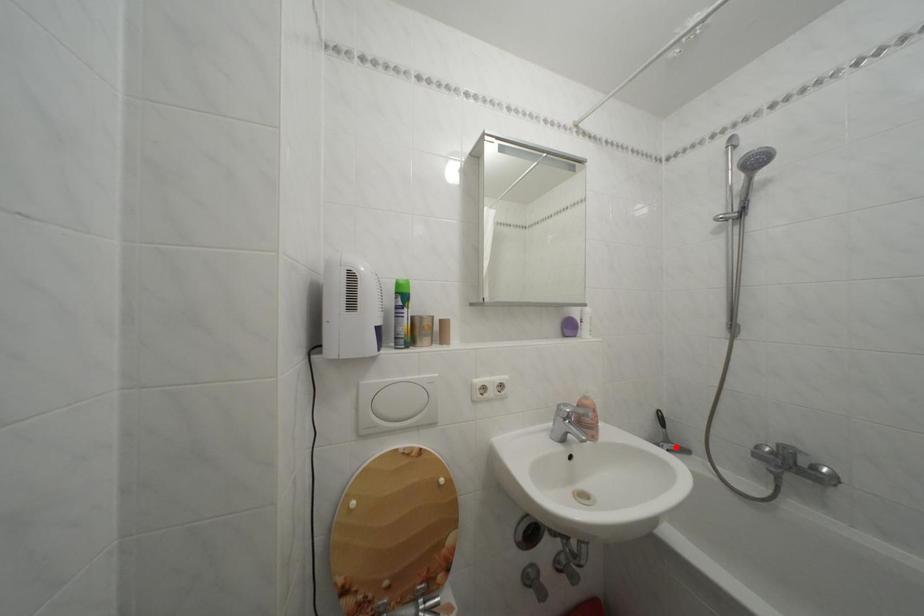
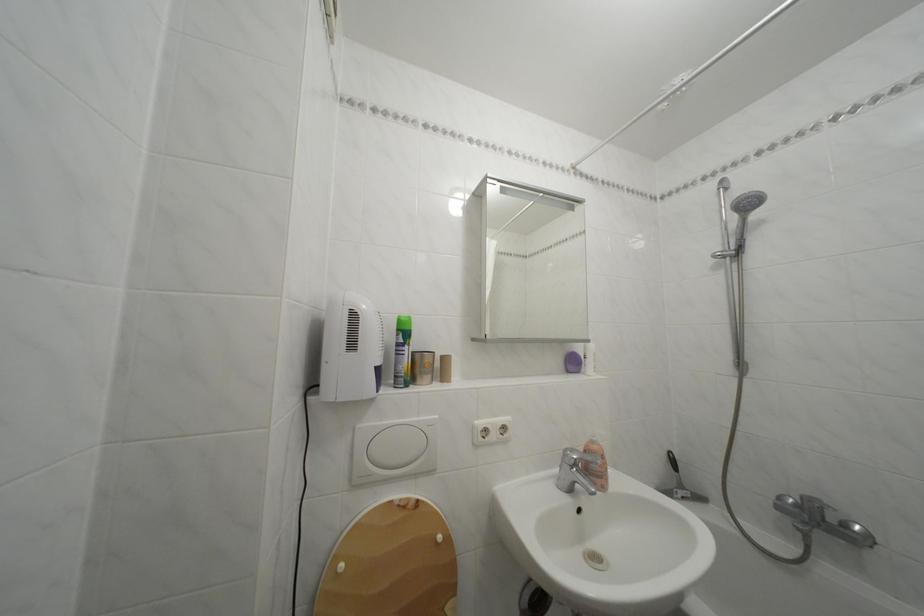
Find the pixel in the second image that matches the highlighted location in the first image.

(689, 492)